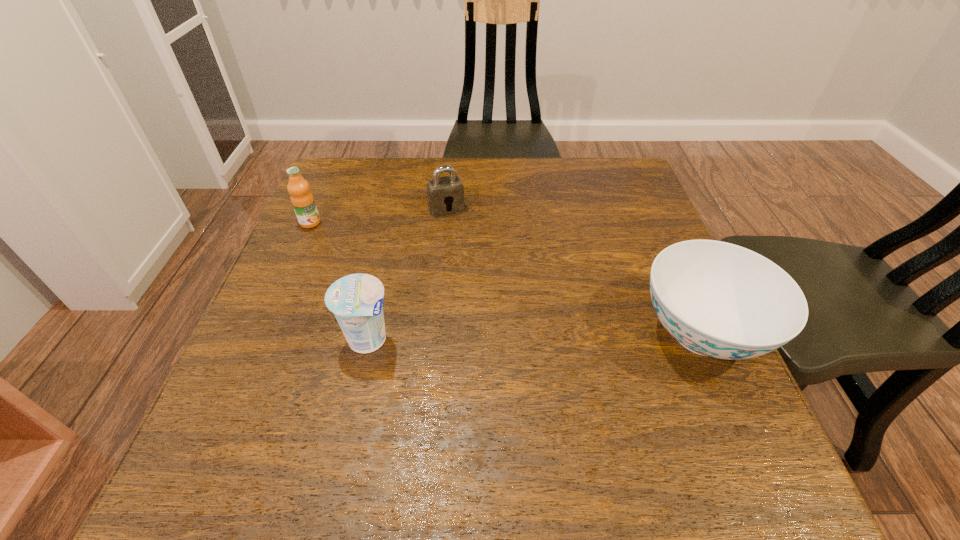
The height and width of the screenshot is (540, 960). What are the coordinates of `free space at the far left corner of the desktop` in the screenshot? It's located at (353, 204).

Where is `vacant space in between the third object from left to right and the second object from left to right`? vacant space in between the third object from left to right and the second object from left to right is located at coordinates (407, 274).

Identify the location of vacant point located between the third object from right to left and the chinaware. The width and height of the screenshot is (960, 540). (535, 336).

Locate an element on the screen. The height and width of the screenshot is (540, 960). vacant area that lies between the yogurt and the padlock is located at coordinates (407, 274).

The width and height of the screenshot is (960, 540). I want to click on vacant space that's between the second object from right to left and the yogurt, so click(x=407, y=274).

Locate an element on the screen. This screenshot has height=540, width=960. vacant space that's between the orange juice and the padlock is located at coordinates (378, 216).

Locate an element on the screen. This screenshot has height=540, width=960. free space between the yogurt and the padlock is located at coordinates (407, 274).

Locate an element on the screen. The width and height of the screenshot is (960, 540). unoccupied position between the rightmost object and the third object from right to left is located at coordinates (535, 336).

Identify the location of vacant space that is in between the second object from left to right and the padlock. (407, 274).

This screenshot has width=960, height=540. I want to click on free space that is in between the second object from left to right and the third object from left to right, so click(407, 274).